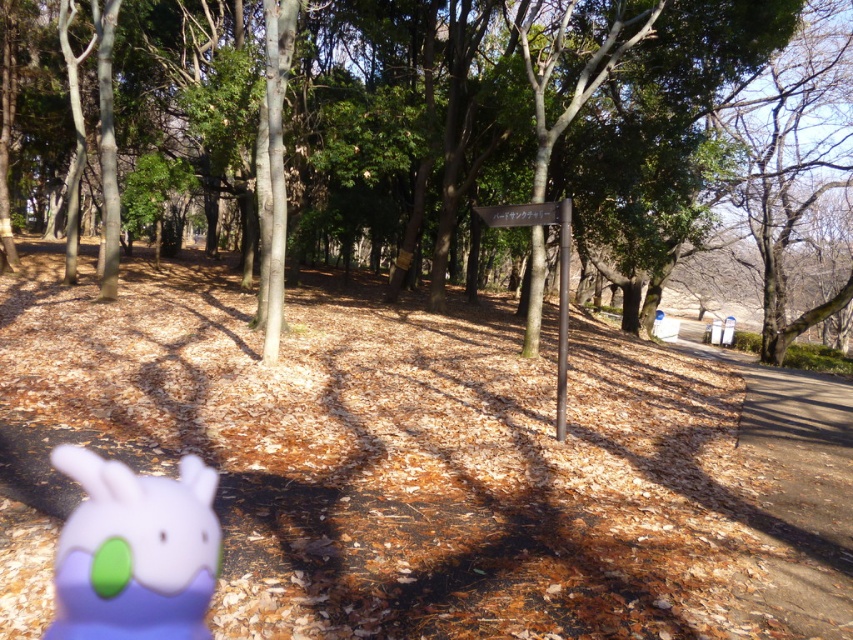
Question: Which point is closer to the camera?

Choices:
 (A) (460, 109)
 (B) (375, 474)

Answer: (B)

Question: Can you confirm if purple matte plush toy at lower left is wider than black wood sign at center?

Choices:
 (A) no
 (B) yes

Answer: (B)

Question: Which point is farther from the camera taking this photo?

Choices:
 (A) (207, 552)
 (B) (531, 220)

Answer: (B)

Question: Which object appears closest to the camera in this image?

Choices:
 (A) purple matte plush toy at lower left
 (B) black wood sign at center
 (C) brown dry leaves at center

Answer: (A)

Question: Does green leafy tree at center have a lesser width compared to black wood sign at center?

Choices:
 (A) no
 (B) yes

Answer: (A)

Question: Does green leafy tree at center have a lesser width compared to purple matte plush toy at lower left?

Choices:
 (A) no
 (B) yes

Answer: (A)